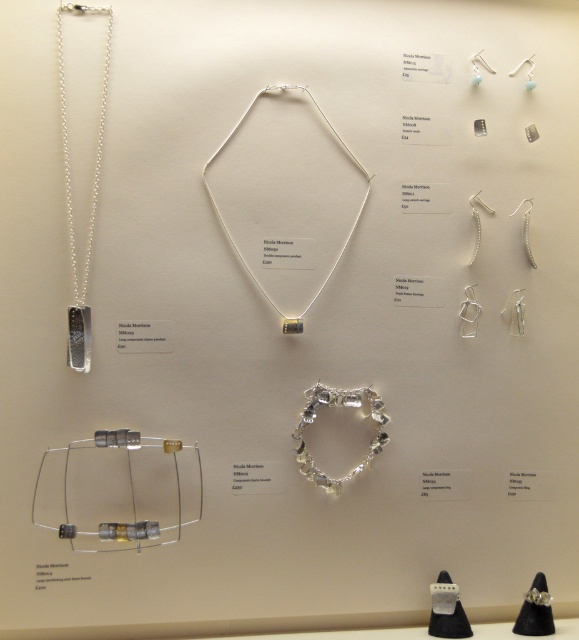
You are a customer browsing the jewelry display. You want to know if the silver metallic chain pendant at left is positioned higher than the clear glass bracelet at center. Can you confirm this?

The silver metallic chain pendant at left is located above the clear glass bracelet at center, so yes, it is positioned higher.